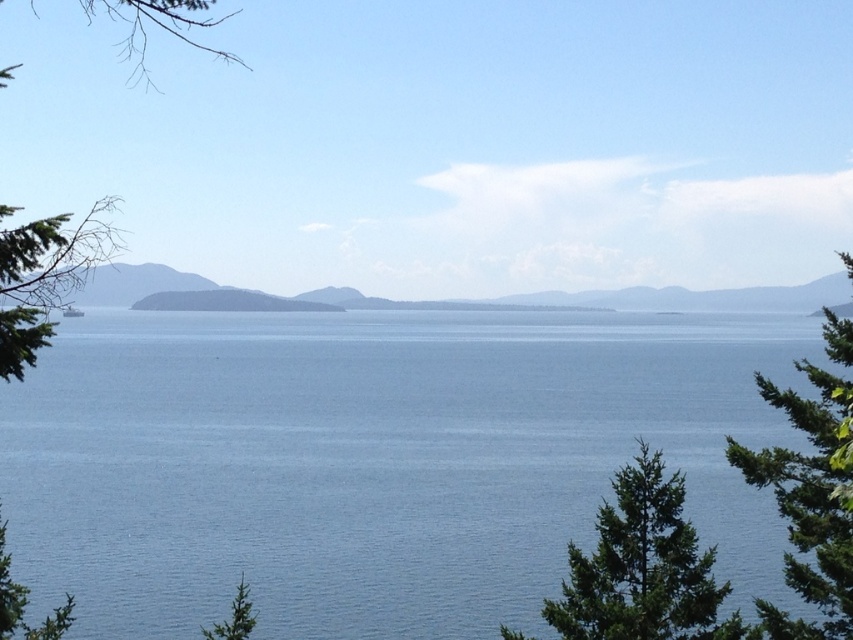
Who is lower down, green textured tree at lower right or green leafy tree at left?

Positioned lower is green textured tree at lower right.

Looking at this image, between green textured tree at lower right and green leafy tree at left, which one is positioned higher?

green leafy tree at left is higher up.

Is point (627, 602) positioned in front of point (10, 312)?

No, (627, 602) is further to viewer.

The height and width of the screenshot is (640, 853). Identify the location of green textured tree at lower right. (643, 568).

Which is above, green textured tree at lower right or green textured tree at right?

green textured tree at lower right is higher up.

Can you confirm if green textured tree at lower right is thinner than green textured tree at right?

Yes.

What do you see at coordinates (643, 568) in the screenshot?
I see `green textured tree at lower right` at bounding box center [643, 568].

The height and width of the screenshot is (640, 853). Find the location of `green textured tree at lower right`. green textured tree at lower right is located at coordinates (643, 568).

Is point (3, 330) farther from camera compared to point (798, 532)?

No, (3, 330) is closer to viewer.

Describe the element at coordinates (44, 276) in the screenshot. The image size is (853, 640). I see `green leafy tree at left` at that location.

What do you see at coordinates (44, 276) in the screenshot? This screenshot has width=853, height=640. I see `green leafy tree at left` at bounding box center [44, 276].

Locate an element on the screen. This screenshot has width=853, height=640. green leafy tree at left is located at coordinates (44, 276).